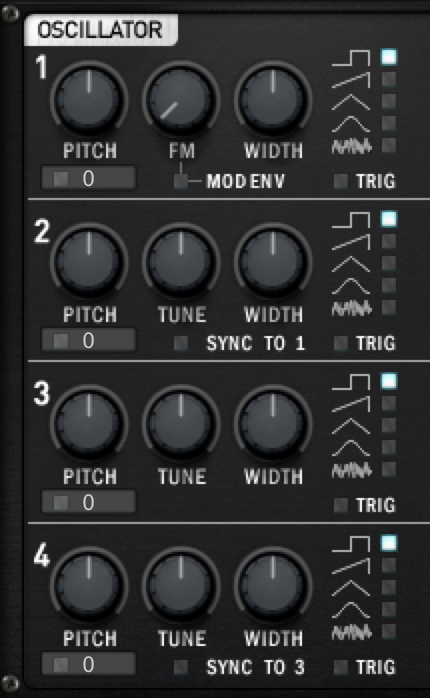
The height and width of the screenshot is (698, 430). Find the location of `control panel`. control panel is located at coordinates (298, 45).